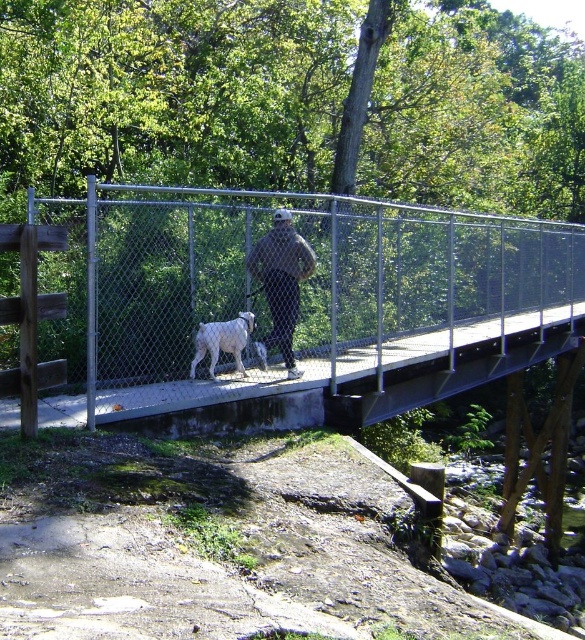
Question: Which object appears closest to the camera in this image?

Choices:
 (A) silver chain-link fence at center
 (B) white fur dog at center

Answer: (A)

Question: Which is nearer to the dark gray fabric jacket at center?

Choices:
 (A) white fur dog at center
 (B) silver chain-link fence at center

Answer: (A)

Question: Observing the image, what is the correct spatial positioning of silver chain-link fence at center in reference to white fur dog at center?

Choices:
 (A) left
 (B) right

Answer: (B)

Question: Does silver chain-link fence at center appear over dark gray fabric jacket at center?

Choices:
 (A) yes
 (B) no

Answer: (A)

Question: Does silver chain-link fence at center appear under dark gray fabric jacket at center?

Choices:
 (A) no
 (B) yes

Answer: (A)

Question: Which object appears farthest from the camera in this image?

Choices:
 (A) dark gray fabric jacket at center
 (B) white fur dog at center
 (C) silver chain-link fence at center

Answer: (B)